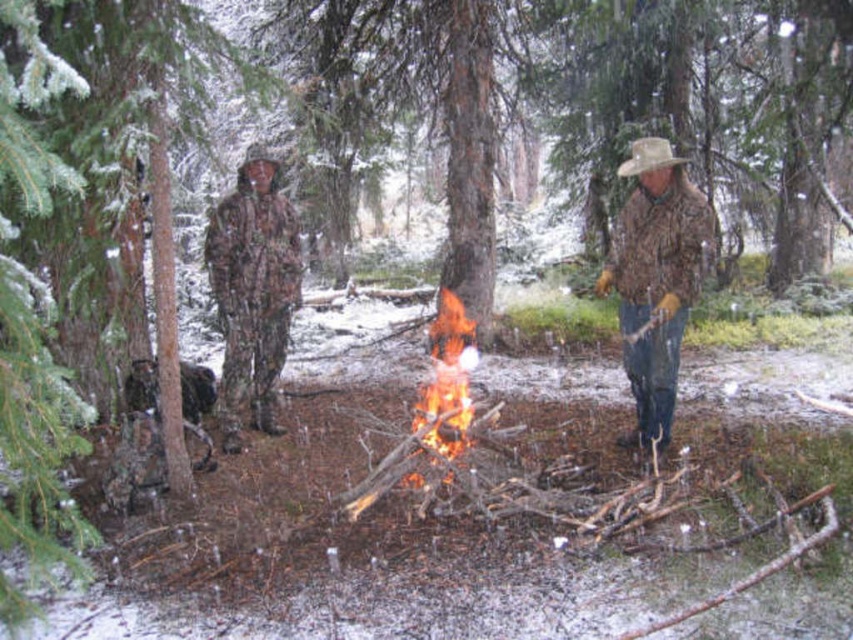
Is camouflage jacket at center positioned at the back of camouflage fabric suit at center?

No, camouflage jacket at center is closer to the viewer.

From the picture: How much distance is there between camouflage jacket at center and camouflage fabric suit at center?

3.04 meters

Does point (654, 301) lie behind point (241, 291)?

No, (654, 301) is in front of (241, 291).

Where is `camouflage jacket at center`? camouflage jacket at center is located at coordinates (654, 276).

Does camouflage fabric suit at center appear on the left side of flaming wood at center?

Indeed, camouflage fabric suit at center is positioned on the left side of flaming wood at center.

Between camouflage fabric suit at center and flaming wood at center, which one is positioned lower?

flaming wood at center

Between point (239, 240) and point (466, 336), which one is positioned behind?

Positioned behind is point (466, 336).

Identify the location of camouflage fabric suit at center. The height and width of the screenshot is (640, 853). (252, 291).

Can you confirm if camouflage jacket at center is smaller than flaming wood at center?

No, camouflage jacket at center is not smaller than flaming wood at center.

Who is more forward, (642, 218) or (448, 388)?

Point (642, 218) is in front.

The width and height of the screenshot is (853, 640). Describe the element at coordinates (654, 276) in the screenshot. I see `camouflage jacket at center` at that location.

Where is `camouflage jacket at center`? This screenshot has width=853, height=640. camouflage jacket at center is located at coordinates (654, 276).